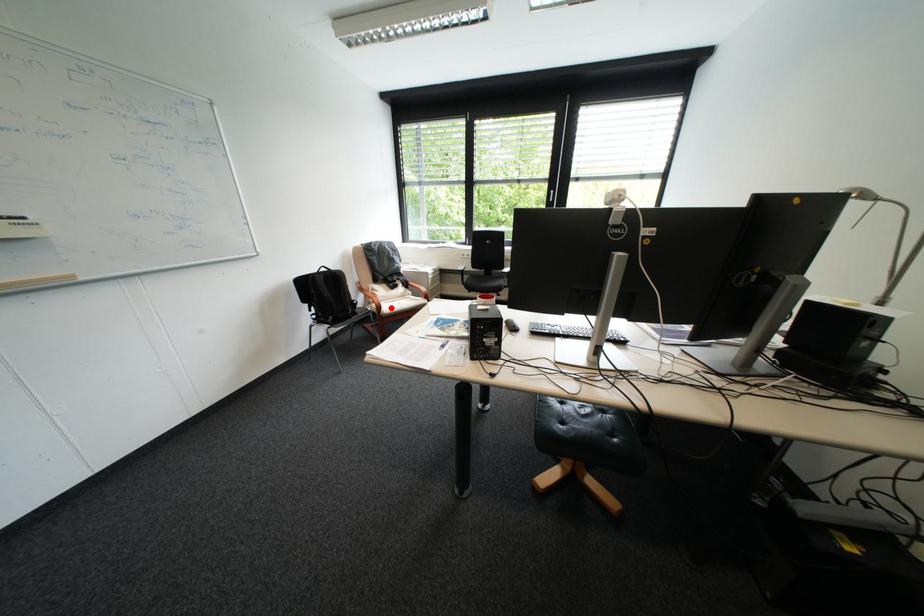
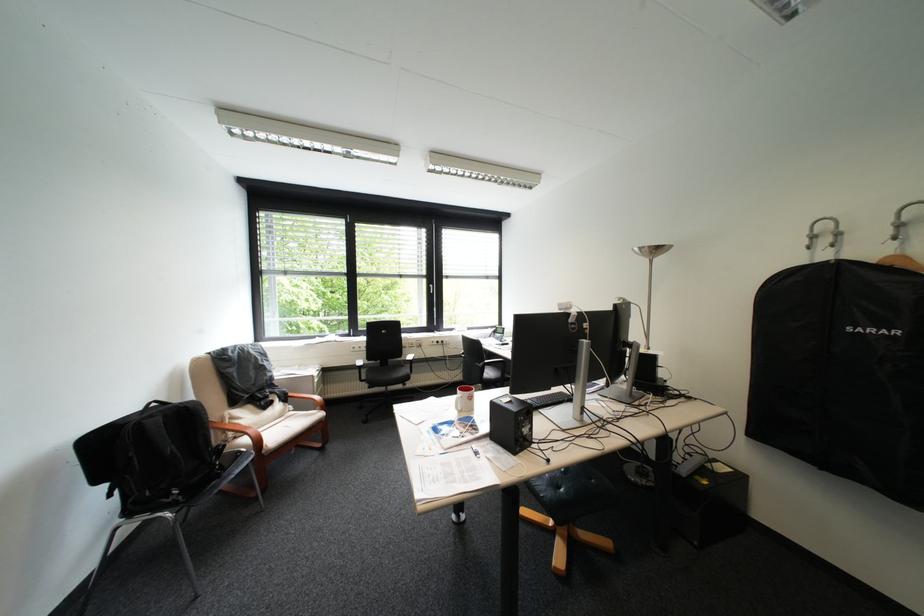
Question: I am providing you with two images of the same scene from different viewpoints. A red point is shown in image1. For the corresponding object point in image2, is it positioned nearer or farther from the camera?

Choices:
 (A) Nearer
 (B) Farther

Answer: (B)